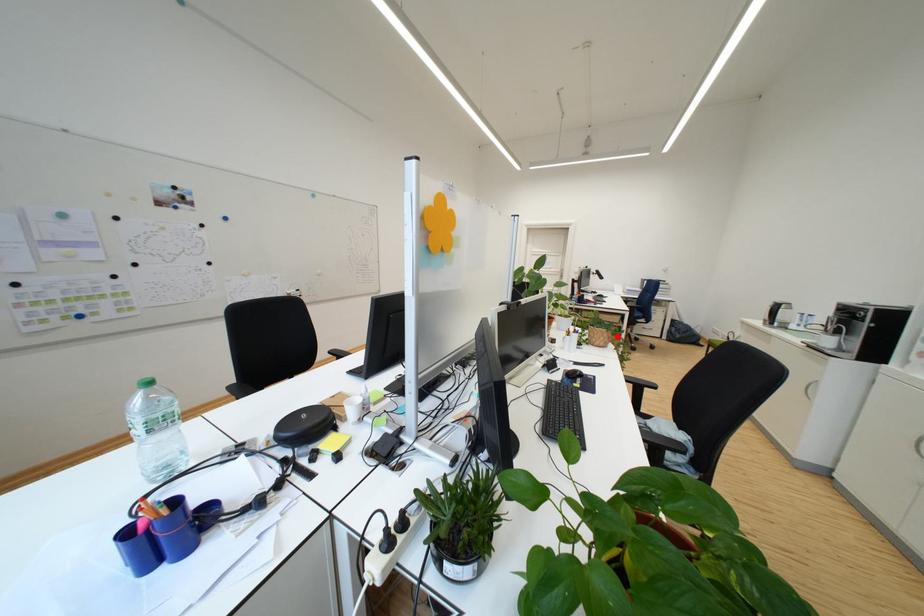
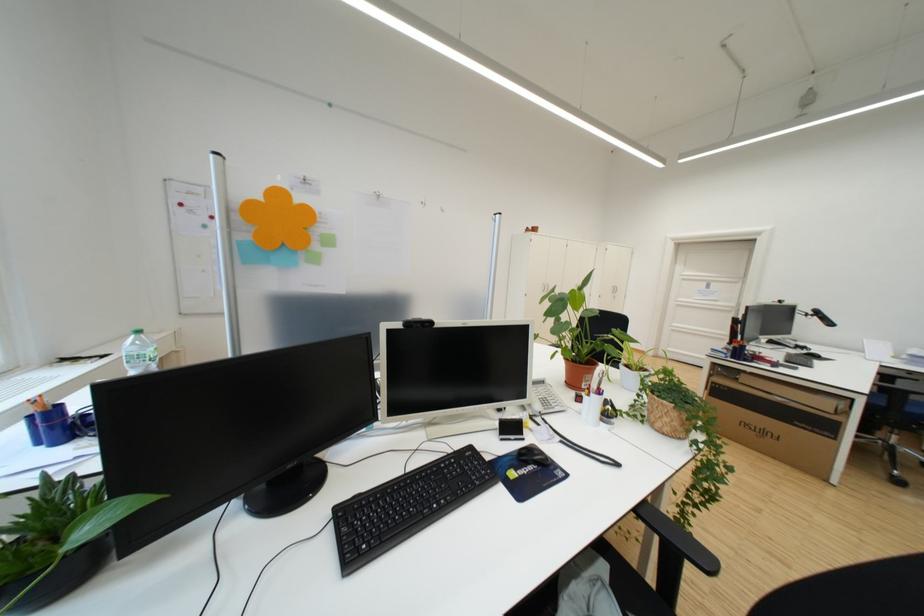
Locate, in the second image, the point that corresponds to the highlighted location in the first image.

(687, 416)